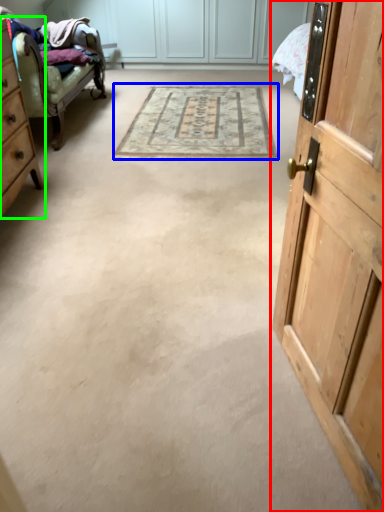
Question: Which object is the closest to the door (highlighted by a red box)? Choose among these: mat (highlighted by a blue box) or cabinetry (highlighted by a green box).

Choices:
 (A) mat
 (B) cabinetry

Answer: (B)